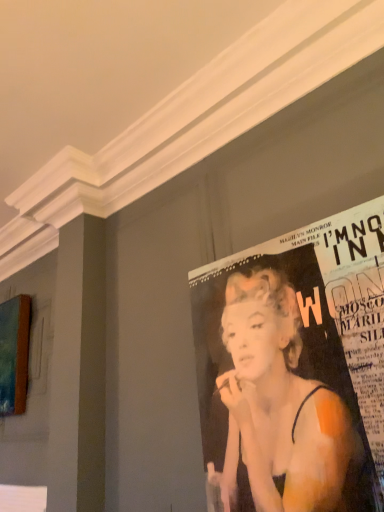
Question: Would you say teal canvas painting at left is part of matte paper poster at upper right's contents?

Choices:
 (A) yes
 (B) no

Answer: (B)

Question: Is matte paper poster at upper right positioned far away from teal canvas painting at left?

Choices:
 (A) no
 (B) yes

Answer: (B)

Question: Is matte paper poster at upper right shorter than teal canvas painting at left?

Choices:
 (A) yes
 (B) no

Answer: (B)

Question: Is matte paper poster at upper right behind teal canvas painting at left?

Choices:
 (A) no
 (B) yes

Answer: (A)

Question: Is matte paper poster at upper right to the left of teal canvas painting at left from the viewer's perspective?

Choices:
 (A) no
 (B) yes

Answer: (A)

Question: From the image's perspective, is matte paper poster at upper right on top of teal canvas painting at left?

Choices:
 (A) no
 (B) yes

Answer: (B)

Question: Considering the relative sizes of teal canvas painting at left and matte paper poster at upper right in the image provided, is teal canvas painting at left taller than matte paper poster at upper right?

Choices:
 (A) yes
 (B) no

Answer: (B)

Question: Is teal canvas painting at left behind matte paper poster at upper right?

Choices:
 (A) yes
 (B) no

Answer: (A)

Question: Is teal canvas painting at left in front of matte paper poster at upper right?

Choices:
 (A) no
 (B) yes

Answer: (A)

Question: Is teal canvas painting at left wider than matte paper poster at upper right?

Choices:
 (A) yes
 (B) no

Answer: (A)

Question: Can you confirm if teal canvas painting at left is bigger than matte paper poster at upper right?

Choices:
 (A) no
 (B) yes

Answer: (B)

Question: From a real-world perspective, does teal canvas painting at left sit lower than matte paper poster at upper right?

Choices:
 (A) yes
 (B) no

Answer: (B)

Question: Considering the positions of teal canvas painting at left and matte paper poster at upper right in the image, is teal canvas painting at left wider or thinner than matte paper poster at upper right?

Choices:
 (A) thin
 (B) wide

Answer: (B)